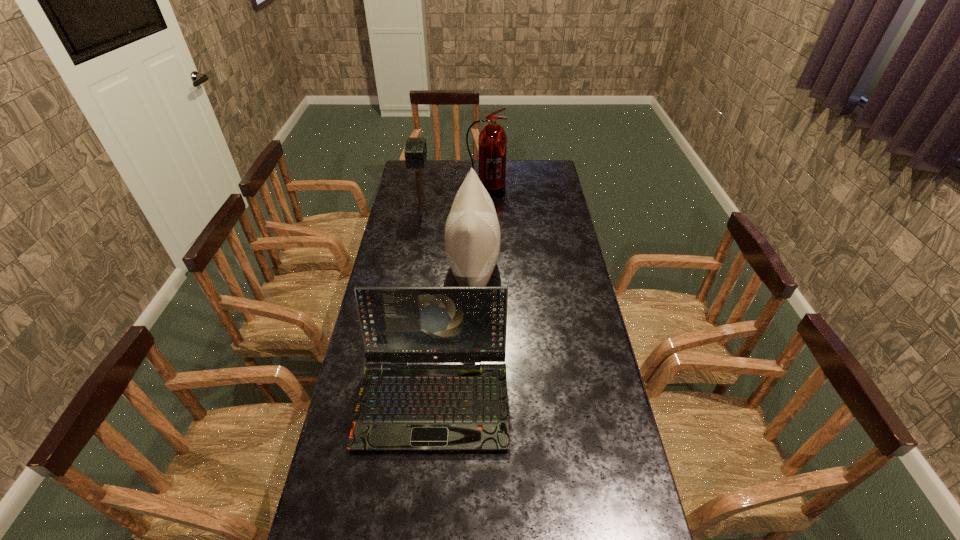
This screenshot has width=960, height=540. What are the coordinates of `free location that satisfies the following two spatial constraints: 1. on the front side of the third farthest object; 2. on the screen of the nearest object` in the screenshot? It's located at (471, 398).

Find the location of a particular element. vacant area in the image that satisfies the following two spatial constraints: 1. on the front side of the second nearest object; 2. on the screen of the nearest object is located at coordinates (471, 398).